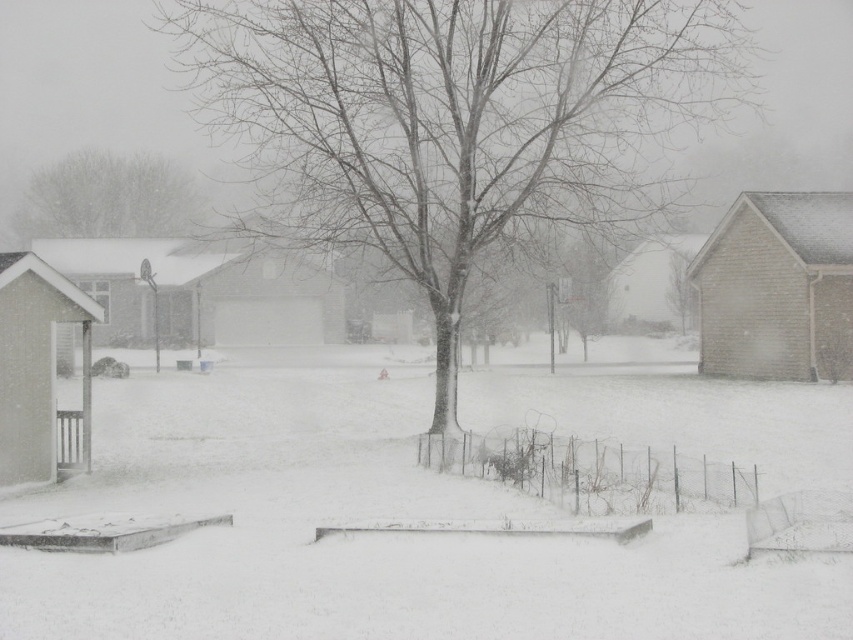
You are a delivery person trying to deliver a package to the white brick garage at center. There is a thick layer of white fluffy snow at center blocking the entrance. Can you step over the snow to reach the garage?

The white fluffy snow at center is positioned under white brick garage at center, so you can step over the snow to reach the garage as it is located beneath the garage structure.

Looking at this image, you are standing in the snowy scene and want to walk from the brown wood fence at left to the bare wood tree at center. Which direction should you move to get closer to the tree?

Since the bare wood tree at center is closer to the viewer than the brown wood fence at left, you should move towards the tree by walking forward from the brown wood fence at left.